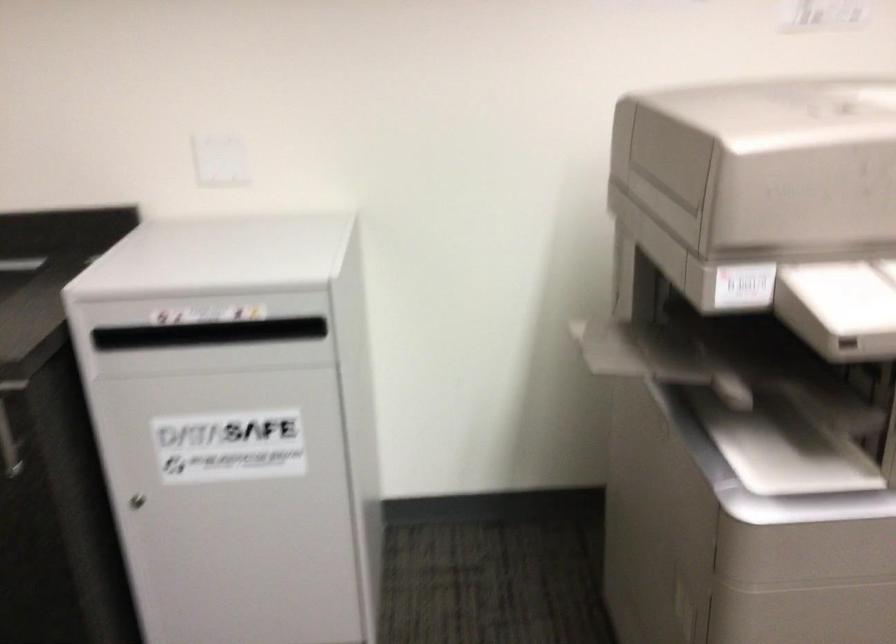
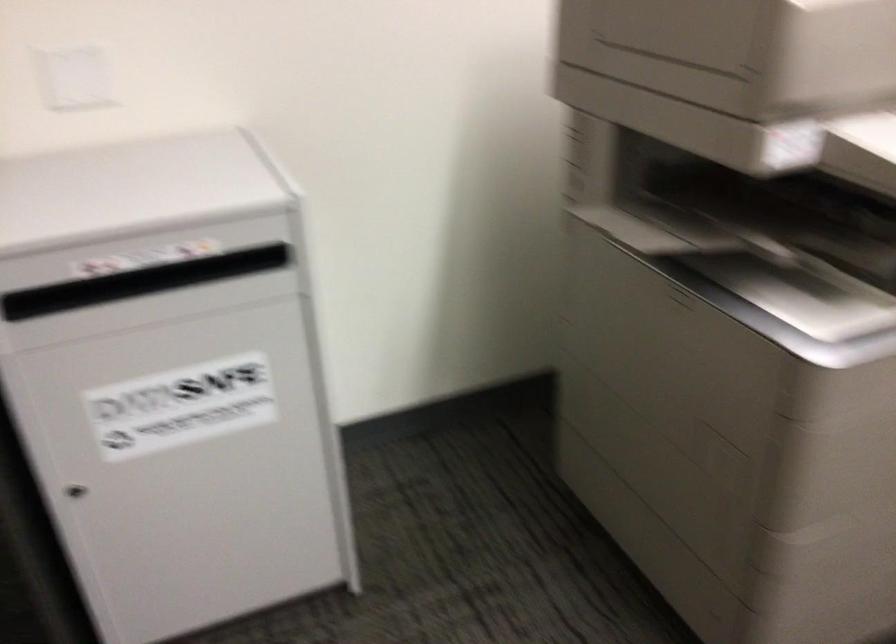
Looking at this image, which direction would the cameraman need to move to produce the second image?

The cameraman moved toward left, forward.